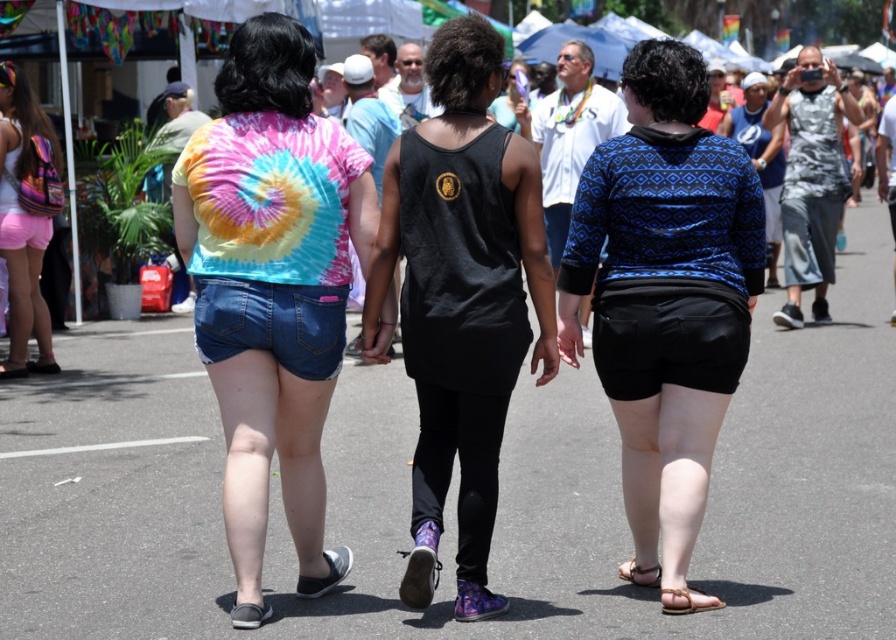
Looking at this image, is blue printed sweater at center behind matte pink shorts at left?

No, it is not.

Find the location of `blue printed sweater at center`. blue printed sweater at center is located at coordinates (664, 291).

Which is in front, point (642, 458) or point (10, 236)?

Positioned in front is point (642, 458).

Identify the location of blue printed sweater at center. (664, 291).

Between tie-dye fabric shirt at center and gray fabric sandal at lower left, which one is positioned lower?

gray fabric sandal at lower left is below.

Does tie-dye fabric shirt at center appear on the left side of gray fabric sandal at lower left?

No, tie-dye fabric shirt at center is not to the left of gray fabric sandal at lower left.

Who is more forward, (237,230) or (242,605)?

Point (242,605) is in front.

Image resolution: width=896 pixels, height=640 pixels. What are the coordinates of `tie-dye fabric shirt at center` in the screenshot? It's located at (272, 284).

Who is taller, tie-dye fabric shirt at center or blue printed sweater at center?

tie-dye fabric shirt at center is taller.

Find the location of a particular element. The image size is (896, 640). tie-dye fabric shirt at center is located at coordinates (272, 284).

Is point (281, 292) closer to camera compared to point (644, 480)?

That is True.

You are a GUI agent. You are given a task and a screenshot of the screen. Output one action in this format:
    pyautogui.click(x=<x>, y=<y>)
    Task: Click on the tie-dye fabric shirt at center
    The width and height of the screenshot is (896, 640).
    Given the screenshot: What is the action you would take?
    pyautogui.click(x=272, y=284)